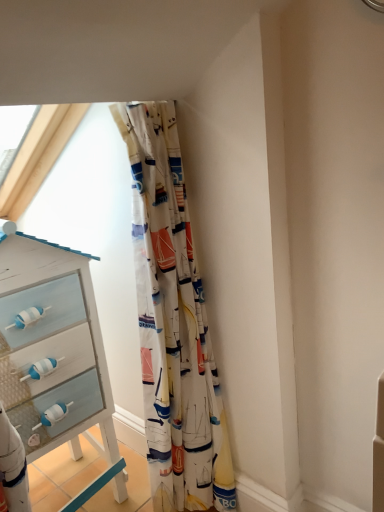
Question: Should I look upward or downward to see printed fabric curtain at center?

Choices:
 (A) down
 (B) up

Answer: (A)

Question: Does white painted wood chest of drawers at left appear on the left side of printed fabric curtain at center?

Choices:
 (A) yes
 (B) no

Answer: (A)

Question: Would you say printed fabric curtain at center is part of white painted wood chest of drawers at left's contents?

Choices:
 (A) yes
 (B) no

Answer: (B)

Question: Can you confirm if white painted wood chest of drawers at left is thinner than printed fabric curtain at center?

Choices:
 (A) yes
 (B) no

Answer: (B)

Question: Can you confirm if white painted wood chest of drawers at left is shorter than printed fabric curtain at center?

Choices:
 (A) yes
 (B) no

Answer: (A)

Question: Is white painted wood chest of drawers at left to the right of printed fabric curtain at center from the viewer's perspective?

Choices:
 (A) yes
 (B) no

Answer: (B)

Question: Is white painted wood chest of drawers at left smaller than printed fabric curtain at center?

Choices:
 (A) yes
 (B) no

Answer: (B)

Question: From the image's perspective, is printed fabric curtain at center located beneath white painted wood chest of drawers at left?

Choices:
 (A) yes
 (B) no

Answer: (B)

Question: Does printed fabric curtain at center have a lesser height compared to white painted wood chest of drawers at left?

Choices:
 (A) no
 (B) yes

Answer: (A)

Question: Is printed fabric curtain at center closer to camera compared to white painted wood chest of drawers at left?

Choices:
 (A) no
 (B) yes

Answer: (B)

Question: Would you say printed fabric curtain at center is a long distance from white painted wood chest of drawers at left?

Choices:
 (A) no
 (B) yes

Answer: (A)

Question: Is white painted wood chest of drawers at left a part of printed fabric curtain at center?

Choices:
 (A) yes
 (B) no

Answer: (B)

Question: Is printed fabric curtain at center at the left side of white painted wood chest of drawers at left?

Choices:
 (A) no
 (B) yes

Answer: (A)

Question: Does point (185, 483) appear closer or farther from the camera than point (99, 338)?

Choices:
 (A) farther
 (B) closer

Answer: (A)